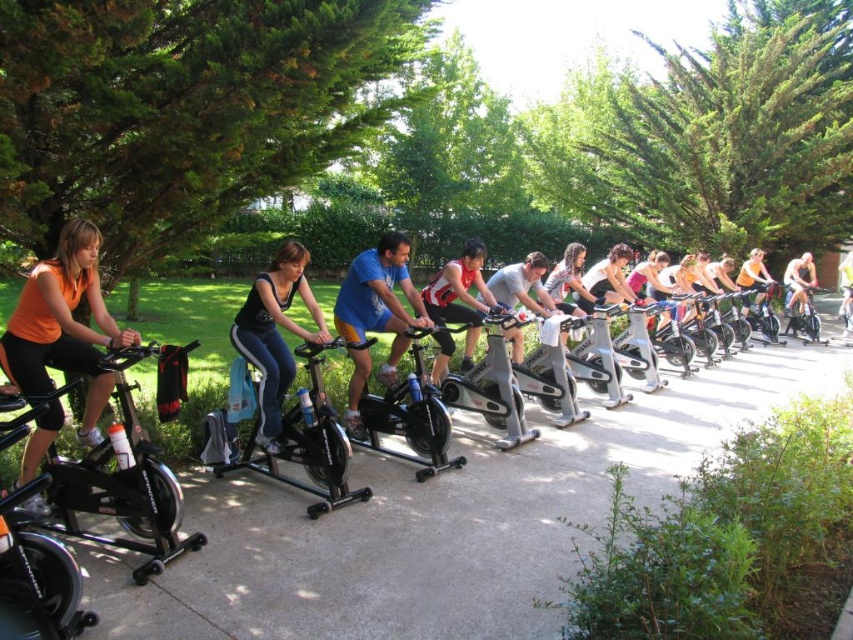
Question: Which of the following is the closest to the observer?

Choices:
 (A) shiny metallic bicycle at center
 (B) matte black tank top at center

Answer: (B)

Question: Which point is closer to the camera?

Choices:
 (A) orange matte tank top at left
 (B) blue fabric shirt at center

Answer: (A)

Question: Is matte gray tank top at center further to camera compared to shiny metallic bicycle at center?

Choices:
 (A) no
 (B) yes

Answer: (A)

Question: Is black matte exercise bike at center to the left of metallic silver bike at center from the viewer's perspective?

Choices:
 (A) yes
 (B) no

Answer: (A)

Question: Does blue fabric shirt at center have a lesser width compared to metallic silver bike at center?

Choices:
 (A) yes
 (B) no

Answer: (B)

Question: Which object is farther from the camera taking this photo?

Choices:
 (A) metallic silver bike at center
 (B) gray concrete pavement at center
 (C) shiny silver bike at center
 (D) matte black tank top at center

Answer: (C)